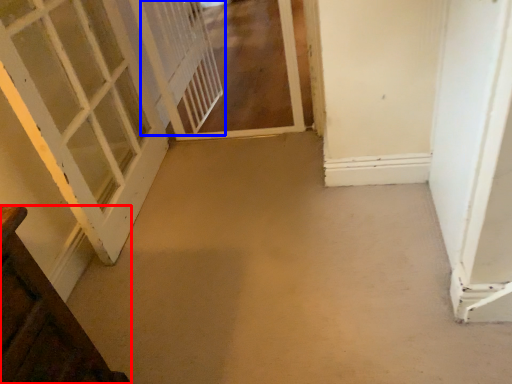
Question: Which object appears farthest to the camera in this image, door (highlighted by a red box) or screen door (highlighted by a blue box)?

Choices:
 (A) door
 (B) screen door

Answer: (B)